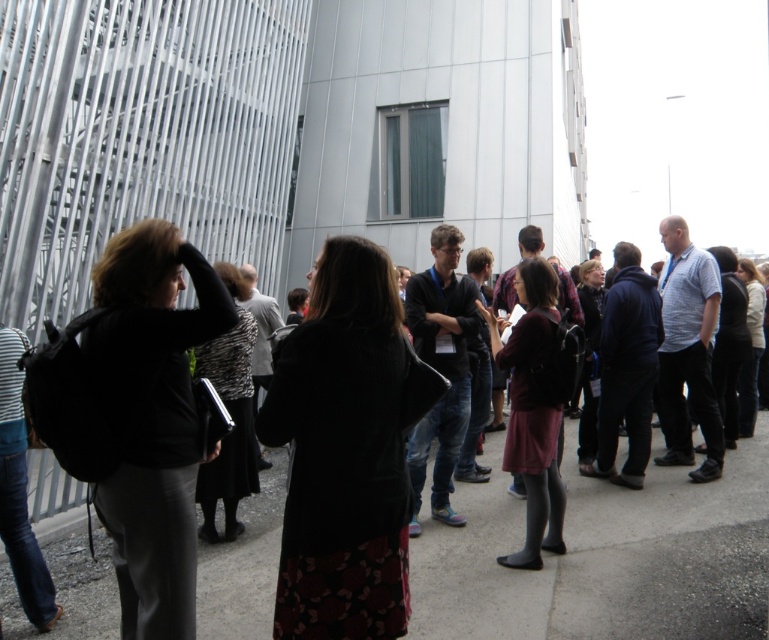
Can you confirm if dark gray sweater at center is bigger than black wool coat at center?

Actually, dark gray sweater at center might be smaller than black wool coat at center.

Which is in front, point (591, 580) or point (391, 465)?

Point (391, 465)

This screenshot has height=640, width=769. Find the location of `dark gray sweater at center`. dark gray sweater at center is located at coordinates (604, 557).

Does black wool coat at center lie behind matte black jacket at left?

No, it is in front of matte black jacket at left.

Between black wool coat at center and matte black jacket at left, which one appears on the right side from the viewer's perspective?

Positioned to the right is black wool coat at center.

This screenshot has width=769, height=640. In order to click on black wool coat at center in this screenshot , I will do `click(345, 451)`.

Does dark gray sweater at center have a lesser width compared to matte black jacket at left?

Incorrect, dark gray sweater at center's width is not less than matte black jacket at left's.

What do you see at coordinates (604, 557) in the screenshot? This screenshot has width=769, height=640. I see `dark gray sweater at center` at bounding box center [604, 557].

The image size is (769, 640). I want to click on dark gray sweater at center, so click(604, 557).